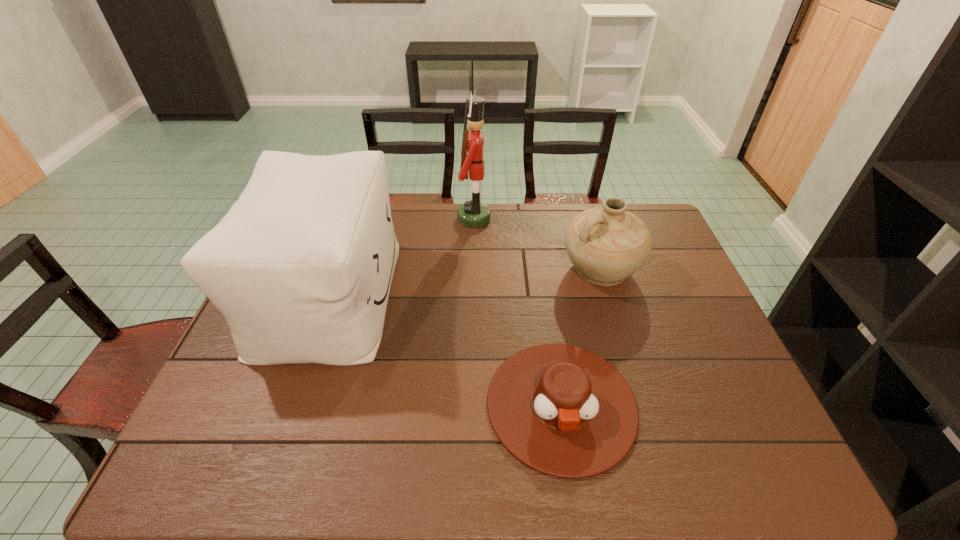
Identify the location of free space between the cowboy hat and the nutcracker. Image resolution: width=960 pixels, height=540 pixels. (517, 311).

I want to click on free space between the cowboy hat and the tallest object, so click(x=517, y=311).

Identify the location of free area in between the second shortest object and the cowboy hat. (581, 336).

This screenshot has width=960, height=540. What are the coordinates of `vacant space that is in between the farthest object and the third tallest object` in the screenshot? It's located at (538, 244).

Where is `vacant space that is in between the farthest object and the second shortest object`? vacant space that is in between the farthest object and the second shortest object is located at coordinates (538, 244).

Image resolution: width=960 pixels, height=540 pixels. In order to click on free spot between the second shortest object and the third shortest object in this screenshot , I will do `click(465, 282)`.

The image size is (960, 540). What are the coordinates of `free space between the cowboy hat and the tallest object` in the screenshot? It's located at (517, 311).

Where is `free space that is in between the second shortest object and the second tallest object`? The height and width of the screenshot is (540, 960). free space that is in between the second shortest object and the second tallest object is located at coordinates (465, 282).

Image resolution: width=960 pixels, height=540 pixels. In order to click on vacant area that lies between the nutcracker and the second tallest object in this screenshot , I will do `click(402, 256)`.

Locate which object is the second closest to the farthest object. Please provide its 2D coordinates. Your answer should be formatted as a tuple, i.e. [(x, y)], where the tuple contains the x and y coordinates of a point satisfying the conditions above.

[(606, 245)]